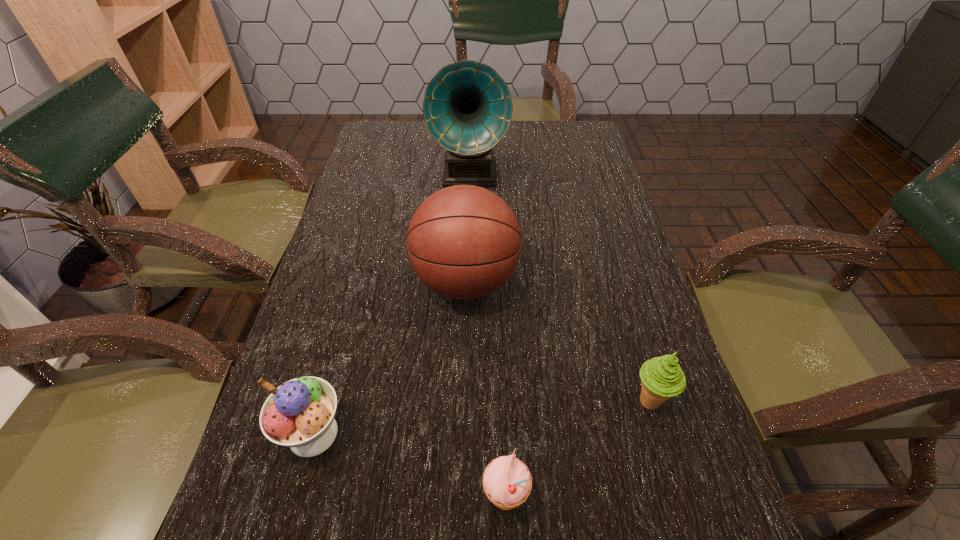
The image size is (960, 540). Find the location of `phonograph_record`. phonograph_record is located at coordinates (467, 107).

You are a GUI agent. You are given a task and a screenshot of the screen. Output one action in this format:
    pyautogui.click(x=<x>, y=<y>)
    Task: Click on the farthest object
    The width and height of the screenshot is (960, 540).
    Given the screenshot: What is the action you would take?
    pyautogui.click(x=467, y=107)

You are a GUI agent. You are given a task and a screenshot of the screen. Output one action in this format:
    pyautogui.click(x=<x>, y=<y>)
    Task: Click on the second farthest object
    Image resolution: width=960 pixels, height=540 pixels.
    Given the screenshot: What is the action you would take?
    pyautogui.click(x=464, y=242)

Image resolution: width=960 pixels, height=540 pixels. I want to click on the fourth shortest object, so 464,242.

The width and height of the screenshot is (960, 540). Find the location of `the rightmost object`. the rightmost object is located at coordinates (661, 377).

Locate an element on the screen. This screenshot has width=960, height=540. the leftmost icecream is located at coordinates (299, 414).

The height and width of the screenshot is (540, 960). Find the location of `the nearest object`. the nearest object is located at coordinates (507, 482).

This screenshot has height=540, width=960. What are the coordinates of `the second icecream from left to right` in the screenshot? It's located at (507, 482).

The image size is (960, 540). What are the coordinates of `vacant area situated 0.290m from the horn of the farthest object` in the screenshot? It's located at (467, 274).

Find the location of a particular element. vacant space located on the front of the basketball is located at coordinates (461, 438).